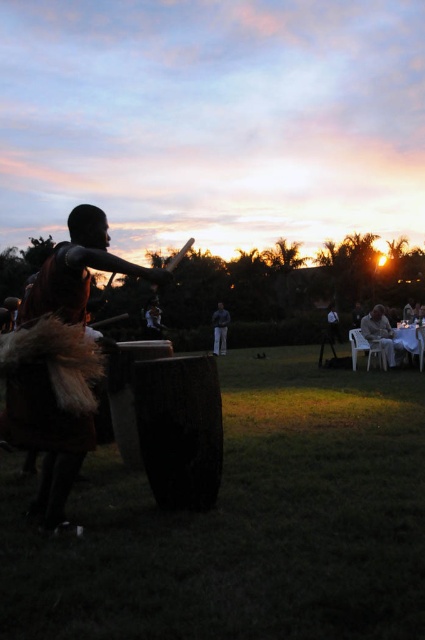
You are a photographer positioned at the center of the scene. You want to capture a closeup shot of the brown fur vest at left and dark gray fabric pants at center. Given that your camera has a maximum focus range of 50 feet, will you be able to focus on both subjects simultaneously?

The brown fur vest at left is 54.75 feet away from dark gray fabric pants at center. Since the camera can only focus up to 50 feet, the distance between them exceeds the maximum focus range. Therefore, you cannot focus on both subjects simultaneously.

You are a photographer standing in the scene and want to capture both the white plastic chair at right and the dark gray fabric pants at center in a single frame. Since you want the objects to appear balanced in the photo, which object should you place closer to the camera?

To balance the objects in the photo, you should place the white plastic chair at right closer to the camera because it is larger in size than the dark gray fabric pants at center, so moving it forward will help create visual equilibrium.